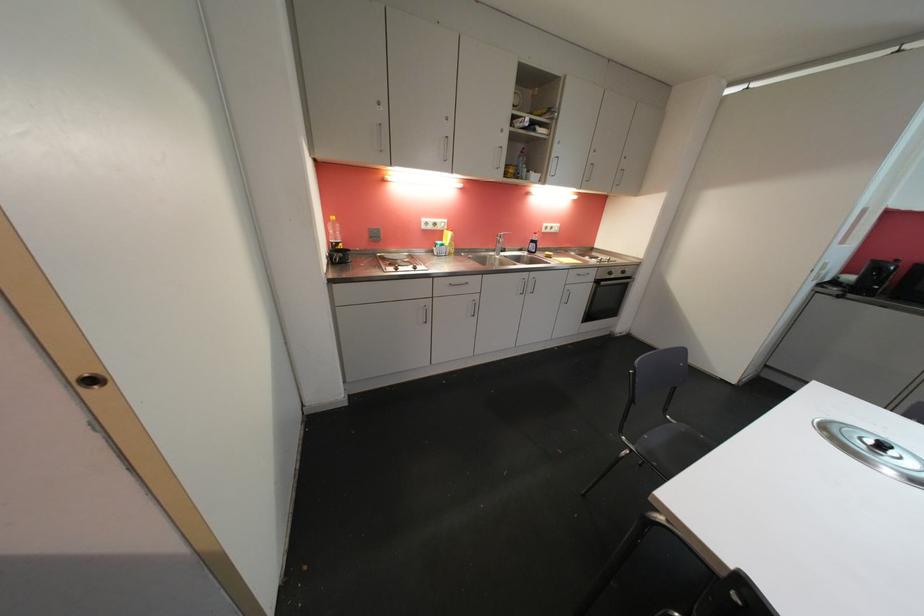
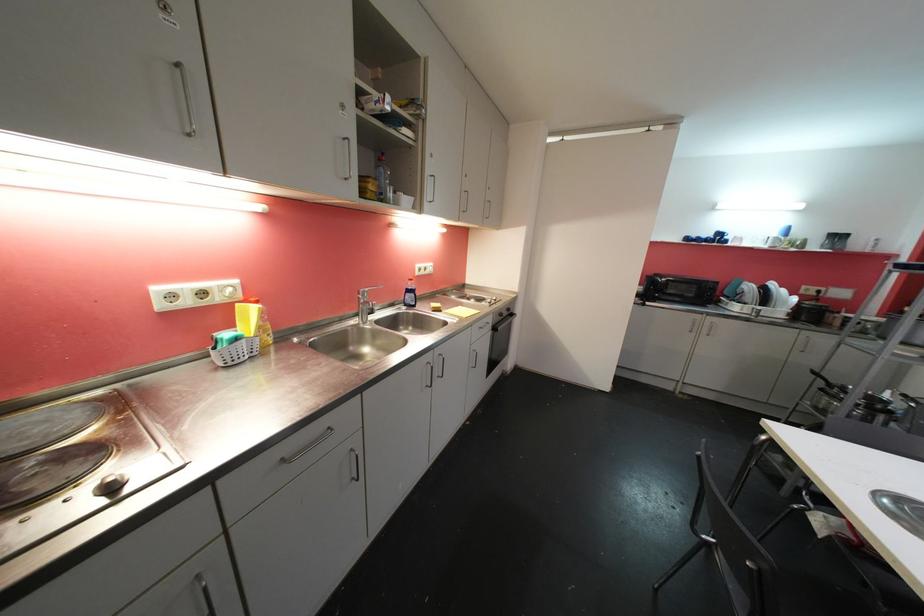
Where in the second image is the point corresponding to (572,291) from the first image?

(477, 352)